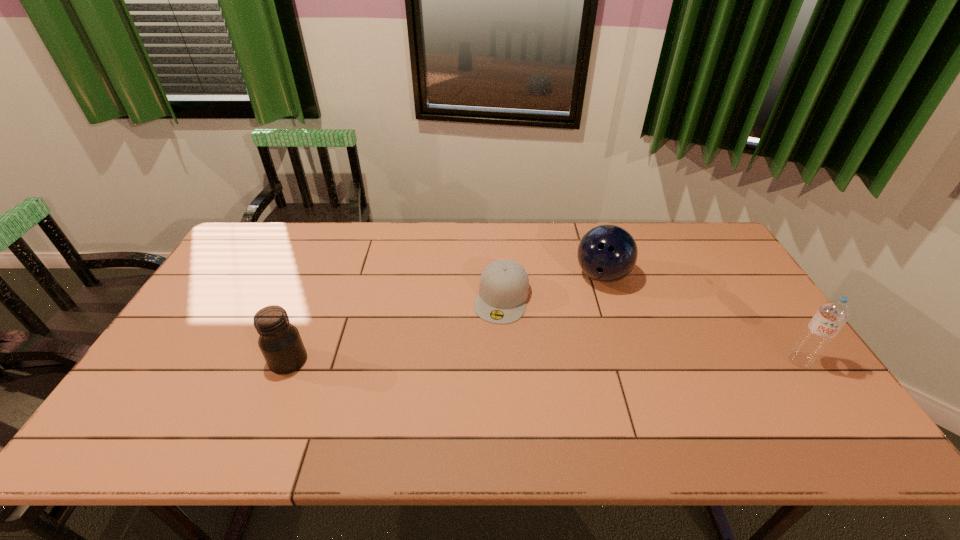
Where is `free region located on the surface of the bowling ball near the finger holes`? free region located on the surface of the bowling ball near the finger holes is located at coordinates (612, 369).

At what (x,y) coordinates should I click in order to perform the action: click on free space located 0.220m on the front-facing side of the cap. Please return your answer as a coordinate pair (x, y). Looking at the image, I should click on (478, 387).

At what (x,y) coordinates should I click in order to perform the action: click on vacant area situated on the front-facing side of the cap. Please return your answer as a coordinate pair (x, y). The height and width of the screenshot is (540, 960). Looking at the image, I should click on pyautogui.click(x=478, y=387).

This screenshot has height=540, width=960. I want to click on vacant space positioned 0.170m on the front-facing side of the cap, so click(483, 371).

Find the location of `object that is at the far edge`. object that is at the far edge is located at coordinates (607, 253).

At what (x,y) coordinates should I click in order to perform the action: click on object located at the right edge. Please return your answer as a coordinate pair (x, y). Image resolution: width=960 pixels, height=540 pixels. Looking at the image, I should click on (831, 316).

The width and height of the screenshot is (960, 540). In the image, there is a desktop. Identify the location of blank space at the far edge. click(656, 248).

This screenshot has width=960, height=540. Identify the location of vacant space at the left edge of the desktop. (238, 265).

Locate an element on the screen. The height and width of the screenshot is (540, 960). free space at the right edge of the desktop is located at coordinates (752, 287).

You are a GUI agent. You are given a task and a screenshot of the screen. Output one action in this format:
    pyautogui.click(x=<x>, y=<y>)
    Task: Click on the vacant space at the far left corner of the desktop
    The image size is (960, 540).
    Given the screenshot: What is the action you would take?
    pyautogui.click(x=268, y=244)